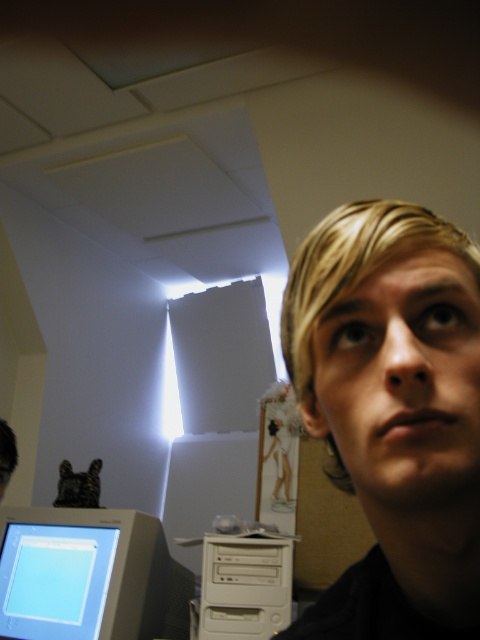
This screenshot has width=480, height=640. Find the location of `blonde hair at right`. blonde hair at right is located at coordinates (393, 412).

Does blonde hair at right lie behind beige plastic monitor at bottom left?

No, it is in front of beige plastic monitor at bottom left.

Who is more forward, (477, 333) or (109, 586)?

Point (477, 333)

This screenshot has height=640, width=480. What are the coordinates of `blonde hair at right` in the screenshot? It's located at (393, 412).

Describe the element at coordinates (393, 412) in the screenshot. The height and width of the screenshot is (640, 480). I see `blonde hair at right` at that location.

Does blonde hair at right appear on the left side of white plastic computer at center?

No, blonde hair at right is not to the left of white plastic computer at center.

Who is more forward, (362, 625) or (267, 570)?

Point (362, 625) is in front.

Where is `blonde hair at right`? The height and width of the screenshot is (640, 480). blonde hair at right is located at coordinates (393, 412).

Is beige plastic monitor at bottom left positioned before white plastic computer at center?

Yes, beige plastic monitor at bottom left is in front of white plastic computer at center.

Is beige plastic monitor at bottom left positioned behind white plastic computer at center?

No, beige plastic monitor at bottom left is closer to the viewer.

In order to click on beige plastic monitor at bottom left in this screenshot , I will do `click(81, 573)`.

Where is `beige plastic monitor at bottom left`? Image resolution: width=480 pixels, height=640 pixels. beige plastic monitor at bottom left is located at coordinates (81, 573).